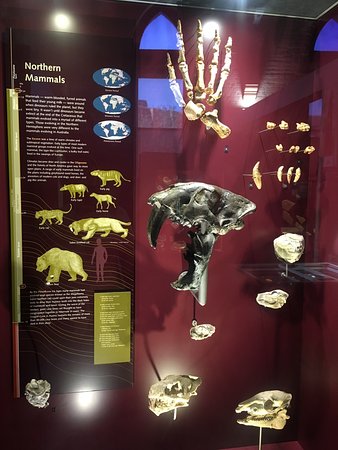
What are the coordinates of `chart` in the screenshot? It's located at (56, 241).